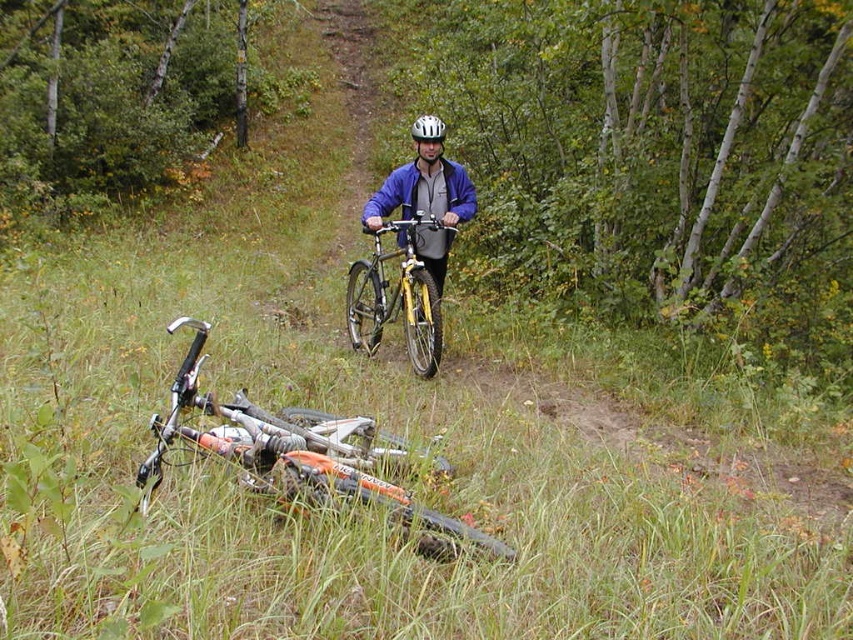
Question: Which object is positioned closest to the white matte bicycle helmet at center?

Choices:
 (A) orange matte mountain bike at lower left
 (B) yellow metallic bicycle at center

Answer: (B)

Question: Which of the following is the farthest from the observer?

Choices:
 (A) white matte bicycle helmet at center
 (B) orange matte mountain bike at lower left
 (C) yellow metallic bicycle at center

Answer: (A)

Question: Which of these objects is positioned closest to the white matte bicycle helmet at center?

Choices:
 (A) yellow metallic bicycle at center
 (B) orange matte mountain bike at lower left

Answer: (A)

Question: Is orange matte mountain bike at lower left above yellow metallic bicycle at center?

Choices:
 (A) yes
 (B) no

Answer: (B)

Question: Is orange matte mountain bike at lower left bigger than white matte bicycle helmet at center?

Choices:
 (A) no
 (B) yes

Answer: (A)

Question: Does orange matte mountain bike at lower left appear over white matte bicycle helmet at center?

Choices:
 (A) no
 (B) yes

Answer: (A)